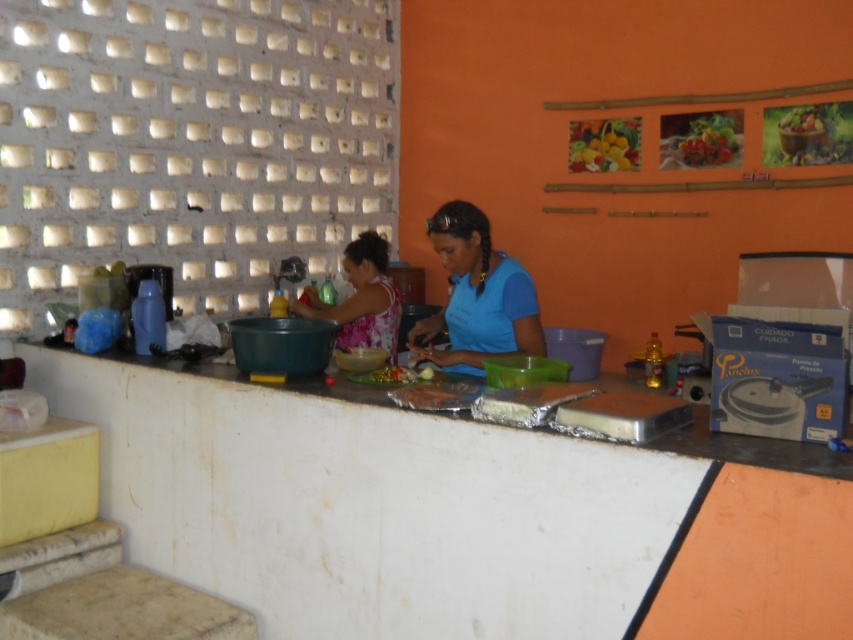
Question: Which of the following is the closest to the observer?

Choices:
 (A) (633, 538)
 (B) (389, 368)

Answer: (A)

Question: Does blue matte shirt at center have a smaller size compared to green leafy vegetables at center?

Choices:
 (A) yes
 (B) no

Answer: (B)

Question: Is marble-like stone stool at lower left above vibrant plastic fruits at center?

Choices:
 (A) yes
 (B) no

Answer: (B)

Question: Which point is closer to the camera taking this photo?

Choices:
 (A) (440, 212)
 (B) (378, 384)
 (C) (144, 577)

Answer: (B)

Question: Does vibrant plastic fruits at center appear on the right side of green leafy vegetables at center?

Choices:
 (A) yes
 (B) no

Answer: (A)

Question: Which point is closer to the camera taking this photo?

Choices:
 (A) (490, 300)
 (B) (137, 625)

Answer: (B)